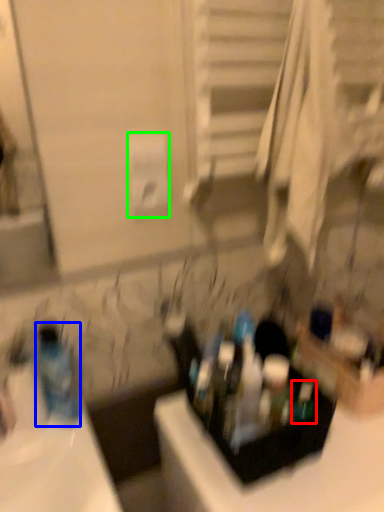
Question: Considering the real-world distances, which object is farthest from mouthwash (highlighted by a red box)? bottle (highlighted by a blue box) or toilet paper (highlighted by a green box)?

Choices:
 (A) bottle
 (B) toilet paper

Answer: (B)